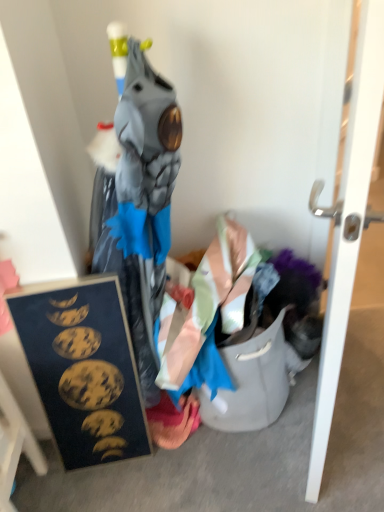
Where is `free point below white glossy door at right (from a real-world perspective)`? Image resolution: width=384 pixels, height=512 pixels. free point below white glossy door at right (from a real-world perspective) is located at coordinates (306, 411).